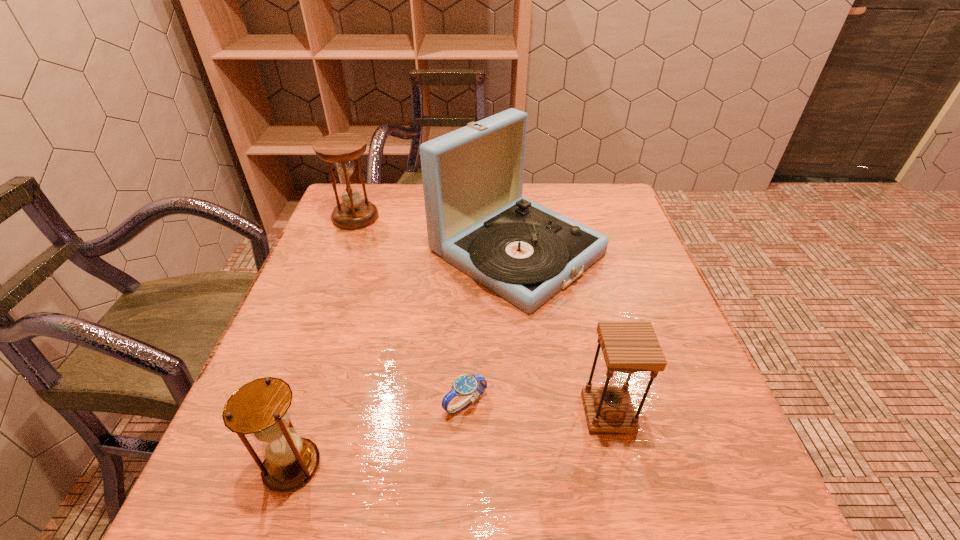
Find the location of `blank region between the tallest object and the nearest hourglass`. blank region between the tallest object and the nearest hourglass is located at coordinates (404, 359).

The height and width of the screenshot is (540, 960). Find the location of `free space between the nearest object and the watch`. free space between the nearest object and the watch is located at coordinates (379, 434).

Where is `free space between the shortest object and the nearest hourglass`? The height and width of the screenshot is (540, 960). free space between the shortest object and the nearest hourglass is located at coordinates tap(379, 434).

Locate an element on the screen. The image size is (960, 540). vacant space that's between the tallest object and the shortest object is located at coordinates (492, 327).

You are a GUI agent. You are given a task and a screenshot of the screen. Output one action in this format:
    pyautogui.click(x=<x>, y=<y>)
    Task: Click on the empty location between the farthest hourglass and the shortest object
    
    Given the screenshot: What is the action you would take?
    pyautogui.click(x=411, y=310)

Locate which object is the third closest to the farthest hourglass. Please provide its 2D coordinates. Your answer should be formatted as a tuple, i.e. [(x, y)], where the tuple contains the x and y coordinates of a point satisfying the conditions above.

[(260, 408)]

The image size is (960, 540). Identify the location of object that stands as the second closest to the nearest hourglass. (477, 220).

Choose which hourglass is the nearest neighbor to the rightmost hourglass. Please provide its 2D coordinates. Your answer should be formatted as a tuple, i.e. [(x, y)], where the tuple contains the x and y coordinates of a point satisfying the conditions above.

[(260, 408)]

Select which hourglass is the closest to the farthest hourglass. Please provide its 2D coordinates. Your answer should be formatted as a tuple, i.e. [(x, y)], where the tuple contains the x and y coordinates of a point satisfying the conditions above.

[(260, 408)]

Identify the location of free location that satisfies the following two spatial constraints: 1. on the front side of the watch; 2. on the right side of the farthest hourglass. Image resolution: width=960 pixels, height=540 pixels. (284, 403).